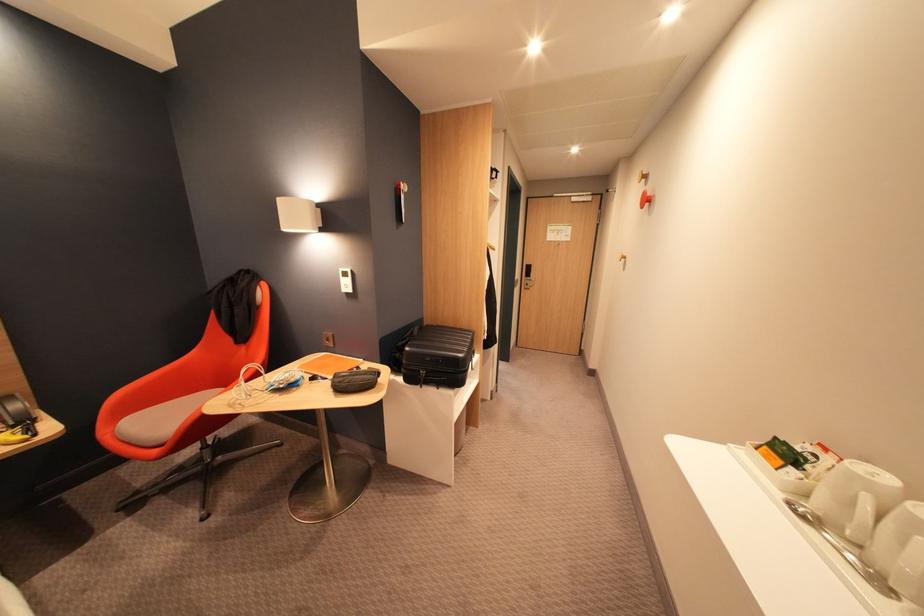
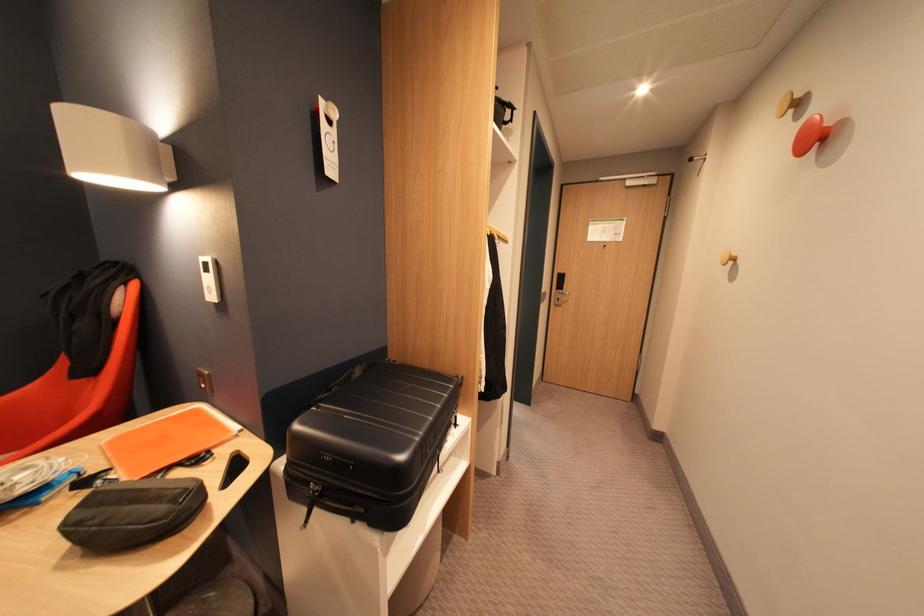
In the second image, find the point that corresponds to (629,257) in the first image.

(736, 259)